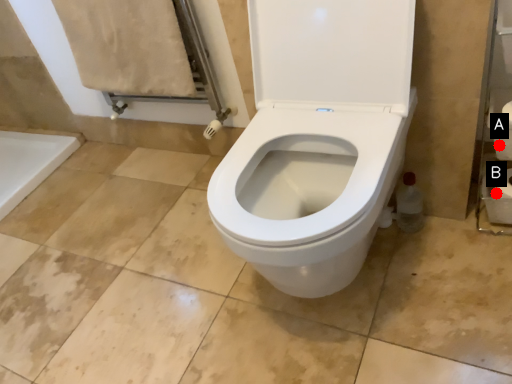
Question: Two points are circled on the image, labeled by A and B beside each circle. Which of the following is the farthest from the observer?

Choices:
 (A) A is further
 (B) B is further

Answer: (B)